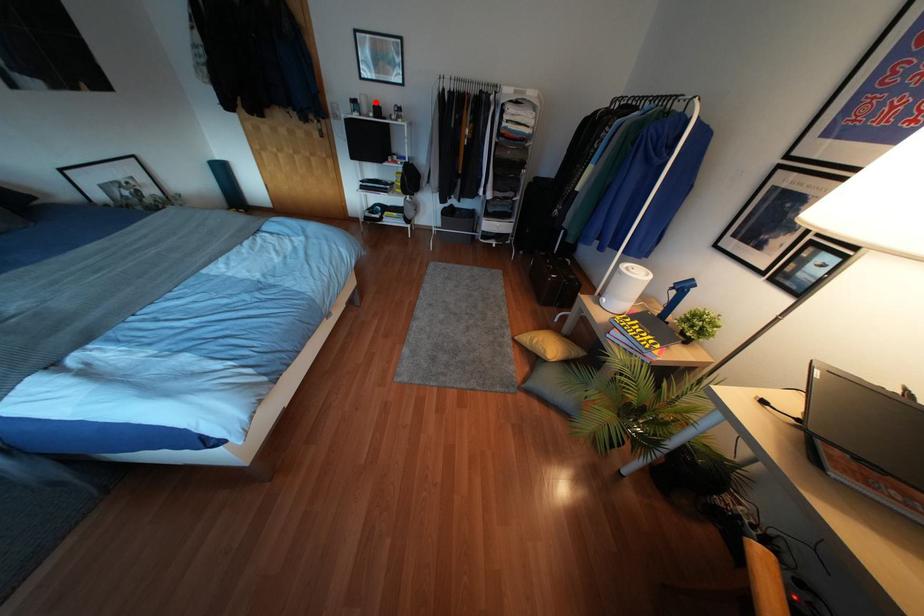
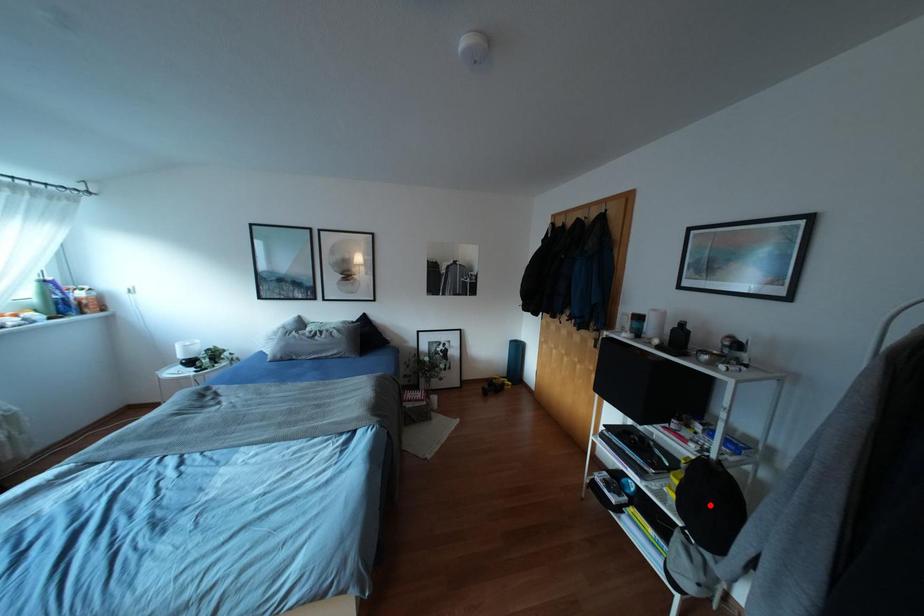
I am providing you with two images of the same scene from different viewpoints. A red point is marked on the first image and another point is marked on the second image. Does the point marked in image1 correspond to the same location as the one in image2?

No